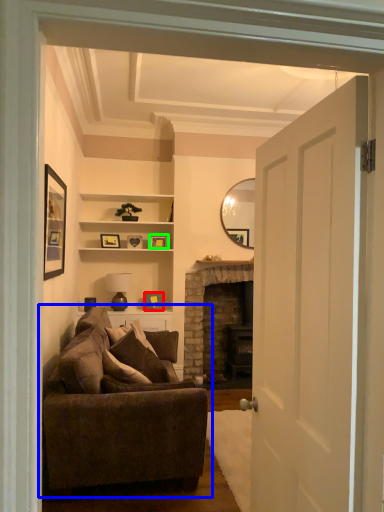
Question: Which object is positioned closest to picture frame (highlighted by a red box)? Select from studio couch (highlighted by a blue box) and picture frame (highlighted by a green box).

Choices:
 (A) studio couch
 (B) picture frame

Answer: (B)